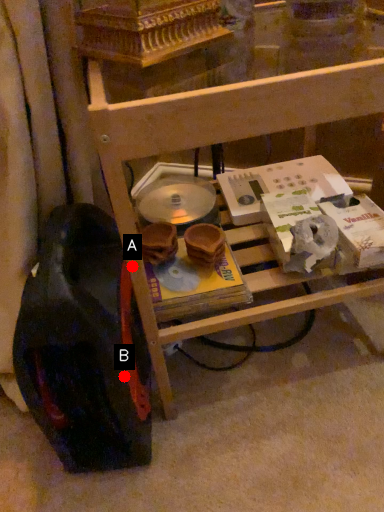
Question: Two points are circled on the image, labeled by A and B beside each circle. Among these points, which one is nearest to the camera?

Choices:
 (A) A is closer
 (B) B is closer

Answer: (A)